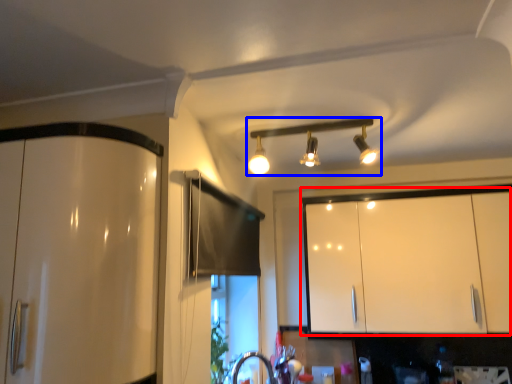
Question: Among these objects, which one is farthest to the camera, cabinetry (highlighted by a red box) or lamp (highlighted by a blue box)?

Choices:
 (A) cabinetry
 (B) lamp

Answer: (A)